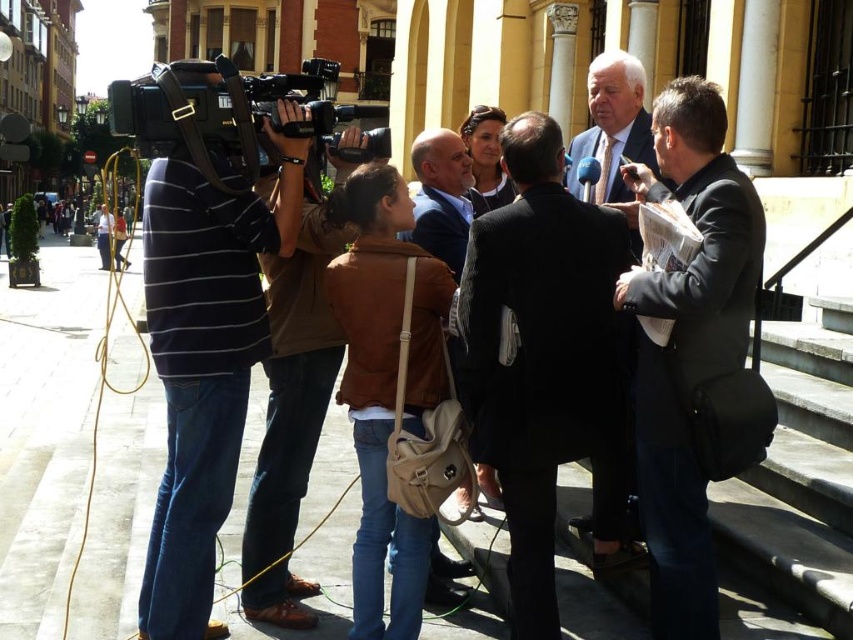
You are a photographer standing at point [708,604]. You want to take a photo of the camera operator who is operating the large video camera. Is the camera operator within your 20 meter range?

The distance between point [708,604] and the camera is 18.79 meters, which is within the 20 meter range. Therefore, the camera operator is within your range.